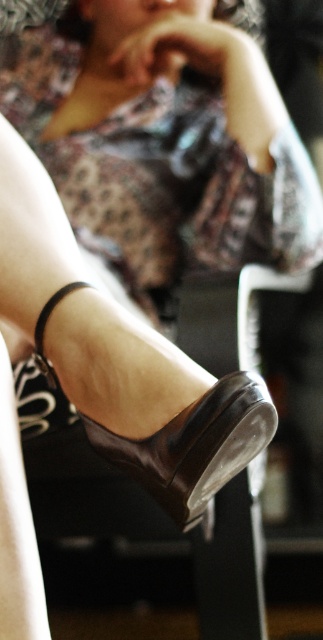
Question: Among these objects, which one is farthest from the camera?

Choices:
 (A) shiny brown sandal at lower center
 (B) matte floral dress at center

Answer: (B)

Question: Is matte floral dress at center to the right of shiny brown sandal at lower center from the viewer's perspective?

Choices:
 (A) yes
 (B) no

Answer: (B)

Question: Among these points, which one is nearest to the camera?

Choices:
 (A) tap(273, 428)
 (B) tap(209, 90)

Answer: (A)

Question: Can you confirm if matte floral dress at center is positioned above shiny brown sandal at lower center?

Choices:
 (A) yes
 (B) no

Answer: (A)

Question: Is matte floral dress at center to the right of shiny brown sandal at lower center from the viewer's perspective?

Choices:
 (A) no
 (B) yes

Answer: (A)